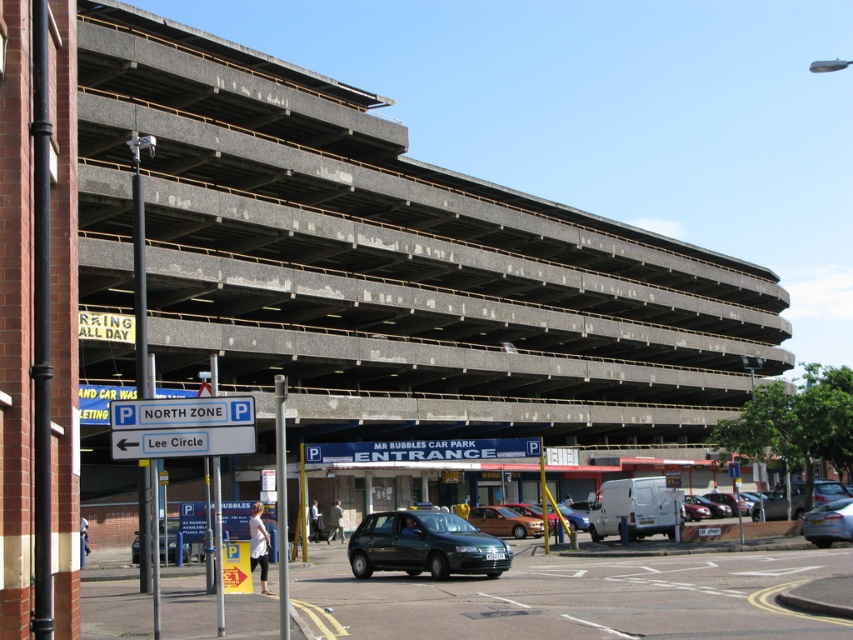
Consider the image. Who is more distant from viewer, (396,557) or (480,520)?

Point (480,520)

Which of these two, matte black hatchback at center or matte brown car at center, stands taller?

matte black hatchback at center

Does point (447, 548) lie in front of point (515, 520)?

Yes, it is.

You are a GUI agent. You are given a task and a screenshot of the screen. Output one action in this format:
    pyautogui.click(x=<x>, y=<y>)
    Task: Click on the matte black hatchback at center
    
    Given the screenshot: What is the action you would take?
    pyautogui.click(x=424, y=545)

Which is behind, point (497, 573) or point (846, 508)?

Point (846, 508)

Does matte black hatchback at center have a lesser height compared to silver metallic sedan at lower right?

No.

The width and height of the screenshot is (853, 640). Identify the location of matte black hatchback at center. (424, 545).

What do you see at coordinates (503, 522) in the screenshot? The image size is (853, 640). I see `matte brown car at center` at bounding box center [503, 522].

Which of these two, matte brown car at center or metallic gray hatchback at lower left, stands taller?

metallic gray hatchback at lower left is taller.

At what (x,y) coordinates should I click in order to perform the action: click on matte brown car at center. Please return your answer as a coordinate pair (x, y). This screenshot has width=853, height=640. Looking at the image, I should click on (503, 522).